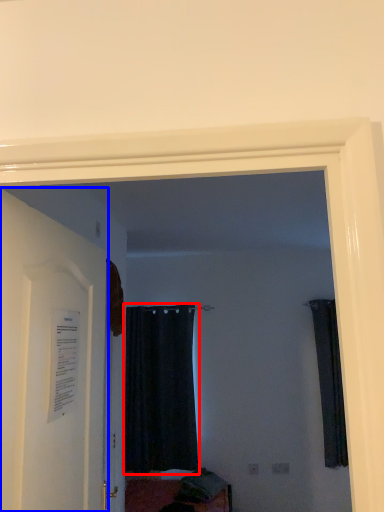
Question: Which point is further to the camera, curtain (highlighted by a red box) or door (highlighted by a blue box)?

Choices:
 (A) curtain
 (B) door

Answer: (A)